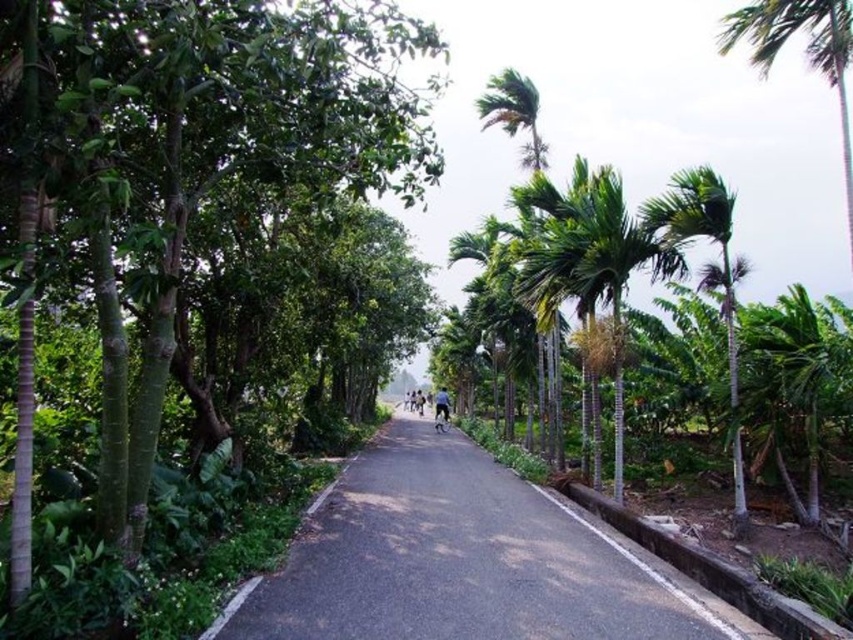
Between point (190, 42) and point (651, 573), which one is positioned behind?

The point (651, 573) is behind.

Does point (152, 387) lie behind point (416, 438)?

No, it is not.

Which is behind, point (132, 429) or point (514, 474)?

Positioned behind is point (514, 474).

Find the location of a particular element. green leafy tree at center is located at coordinates (180, 172).

The width and height of the screenshot is (853, 640). Find the location of `green leafy tree at center`. green leafy tree at center is located at coordinates (180, 172).

In the scene shown: Is green leafy tree at center taller than green leafy palm tree at upper right?

Correct, green leafy tree at center is much taller as green leafy palm tree at upper right.

Is point (68, 202) farther from viewer compared to point (848, 225)?

That is False.

This screenshot has height=640, width=853. Identify the location of green leafy tree at center. (180, 172).

Which is behind, point (650, 620) or point (799, 12)?

Point (799, 12)

Locate an element on the screen. The height and width of the screenshot is (640, 853). black asphalt road at center is located at coordinates (463, 561).